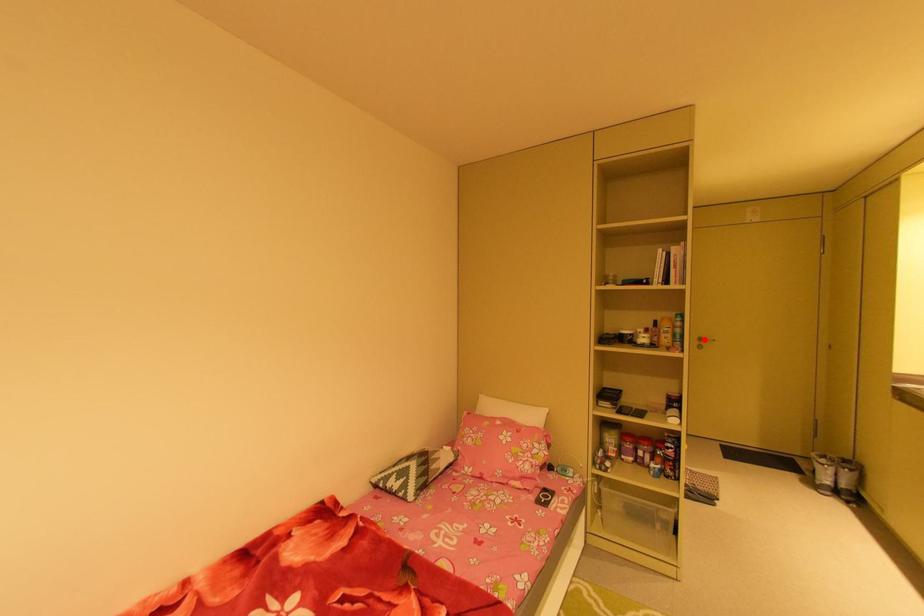
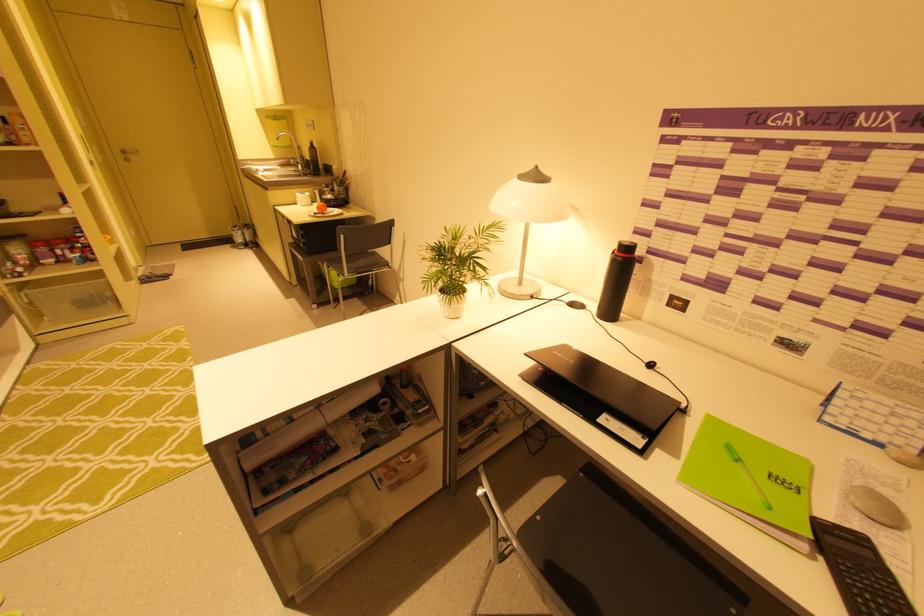
Where in the second image is the point corresponding to the highlighted location from the first image?

(128, 152)